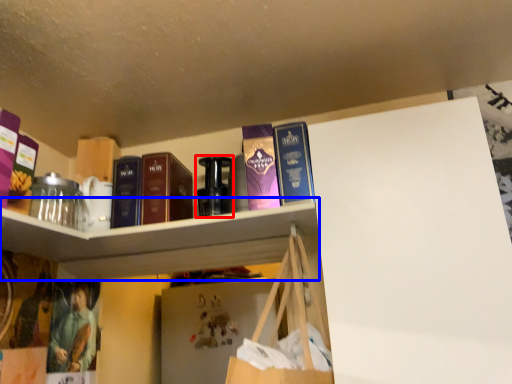
Question: Among these objects, which one is nearest to the camera, bottle (highlighted by a red box) or cabinet (highlighted by a blue box)?

Choices:
 (A) bottle
 (B) cabinet

Answer: (B)